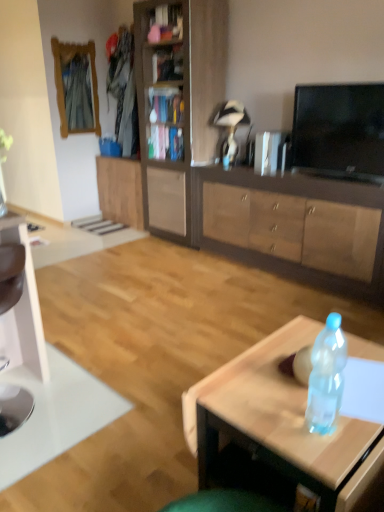
You are a GUI agent. You are given a task and a screenshot of the screen. Output one action in this format:
    pyautogui.click(x=<x>, y=<y>)
    Task: Click on the vacant space behind white glossy computer desk at left
    The width and height of the screenshot is (384, 512).
    Given the screenshot: What is the action you would take?
    pyautogui.click(x=65, y=362)